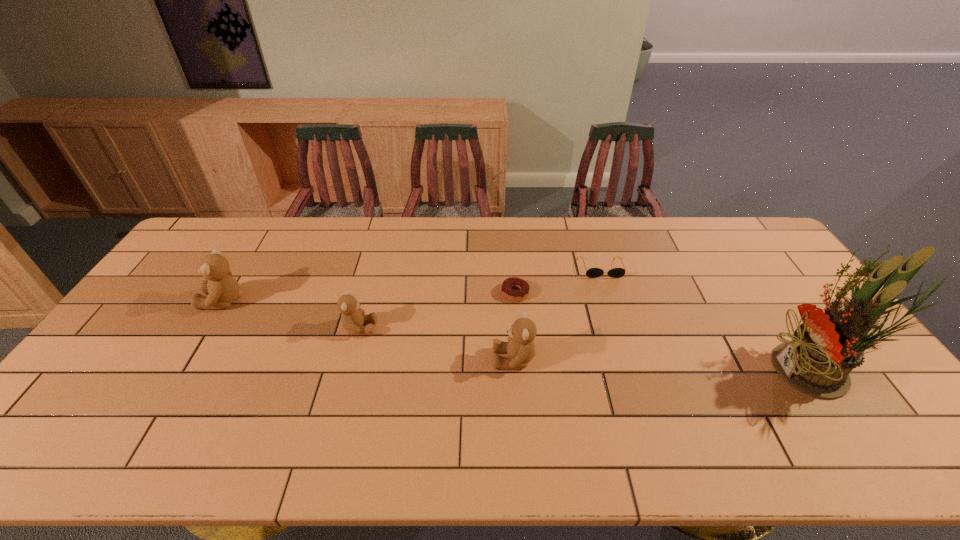
This screenshot has width=960, height=540. Find the location of `the leftmost object`. the leftmost object is located at coordinates (222, 289).

Identify the location of the farthest teddy bear. (222, 289).

Locate an element on the screen. the fourth tallest object is located at coordinates (352, 318).

Locate an element on the screen. the shortest teddy bear is located at coordinates (352, 318).

Where is `the second shortest teddy bear`? This screenshot has width=960, height=540. the second shortest teddy bear is located at coordinates (520, 347).

Identify the location of the nearest teddy bear. This screenshot has width=960, height=540. (520, 347).

Where is `the farthest object`? This screenshot has width=960, height=540. the farthest object is located at coordinates click(592, 272).

This screenshot has height=540, width=960. In order to click on sunglasses in this screenshot , I will do `click(592, 272)`.

Locate an element on the screen. the shortest object is located at coordinates (513, 282).

This screenshot has height=540, width=960. Identify the location of the rightmost object. (826, 347).